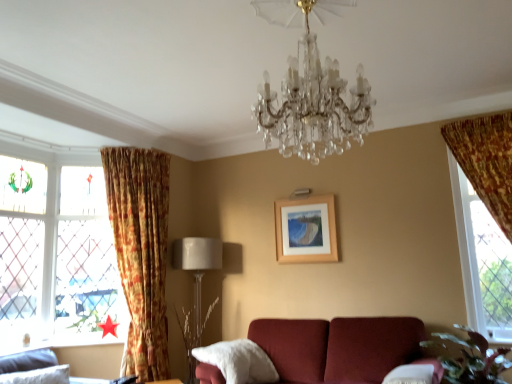
Question: Considering the relative positions of beige fabric lampshade at lower left and velvet gray sofa at lower left in the image provided, is beige fabric lampshade at lower left to the left of velvet gray sofa at lower left from the viewer's perspective?

Choices:
 (A) yes
 (B) no

Answer: (B)

Question: Does beige fabric lampshade at lower left contain velvet gray sofa at lower left?

Choices:
 (A) no
 (B) yes

Answer: (A)

Question: Does beige fabric lampshade at lower left have a greater width compared to velvet gray sofa at lower left?

Choices:
 (A) no
 (B) yes

Answer: (B)

Question: Are beige fabric lampshade at lower left and velvet gray sofa at lower left far apart?

Choices:
 (A) no
 (B) yes

Answer: (B)

Question: Does beige fabric lampshade at lower left have a smaller size compared to velvet gray sofa at lower left?

Choices:
 (A) no
 (B) yes

Answer: (A)

Question: Is beige fabric lampshade at lower left facing away from velvet gray sofa at lower left?

Choices:
 (A) yes
 (B) no

Answer: (B)

Question: Is wooden frame at center smaller than clear crystal chandelier at center?

Choices:
 (A) yes
 (B) no

Answer: (A)

Question: Is wooden frame at center located outside clear crystal chandelier at center?

Choices:
 (A) yes
 (B) no

Answer: (A)

Question: Could you tell me if wooden frame at center is turned towards clear crystal chandelier at center?

Choices:
 (A) no
 (B) yes

Answer: (B)

Question: Does wooden frame at center have a lesser width compared to clear crystal chandelier at center?

Choices:
 (A) no
 (B) yes

Answer: (B)

Question: From the image's perspective, would you say wooden frame at center is positioned over clear crystal chandelier at center?

Choices:
 (A) yes
 (B) no

Answer: (B)

Question: Is wooden frame at center far from clear crystal chandelier at center?

Choices:
 (A) no
 (B) yes

Answer: (B)

Question: Considering the relative sizes of clear crystal chandelier at center and stained glass window at left, positioned as the first window in back-to-front order, in the image provided, is clear crystal chandelier at center smaller than stained glass window at left, positioned as the first window in back-to-front order,?

Choices:
 (A) no
 (B) yes

Answer: (A)